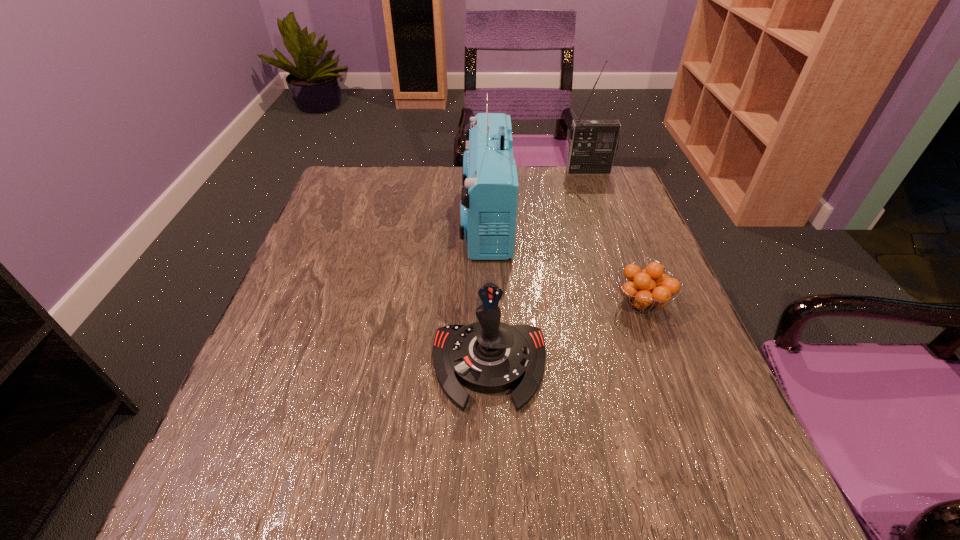
You are a GUI agent. You are given a task and a screenshot of the screen. Output one action in this format:
    pyautogui.click(x=<x>, y=<y>)
    Task: Click on the object that is the second nearest to the orange fruit
    Image resolution: width=960 pixels, height=540 pixels.
    Given the screenshot: What is the action you would take?
    pyautogui.click(x=489, y=197)

Locate which object is the third closest to the farthest object. Please provide its 2D coordinates. Your answer should be formatted as a tuple, i.e. [(x, y)], where the tuple contains the x and y coordinates of a point satisfying the conditions above.

[(489, 356)]

The width and height of the screenshot is (960, 540). I want to click on free space that satisfies the following two spatial constraints: 1. on the display of the right radio receiver; 2. on the front-facing side of the third nearest object, so click(606, 219).

Find the location of a particular element. The image size is (960, 540). free space that satisfies the following two spatial constraints: 1. on the front-facing side of the shortest object; 2. on the right side of the left radio receiver is located at coordinates (488, 303).

At what (x,y) coordinates should I click in order to perform the action: click on free space in the image that satisfies the following two spatial constraints: 1. on the front-facing side of the orange fruit; 2. on the right side of the nearer radio receiver. Please return your answer as a coordinate pair (x, y). Image resolution: width=960 pixels, height=540 pixels. Looking at the image, I should click on (488, 303).

Identify the location of free space that satisfies the following two spatial constraints: 1. on the display of the farther radio receiver; 2. on the front-facing side of the left radio receiver. (606, 219).